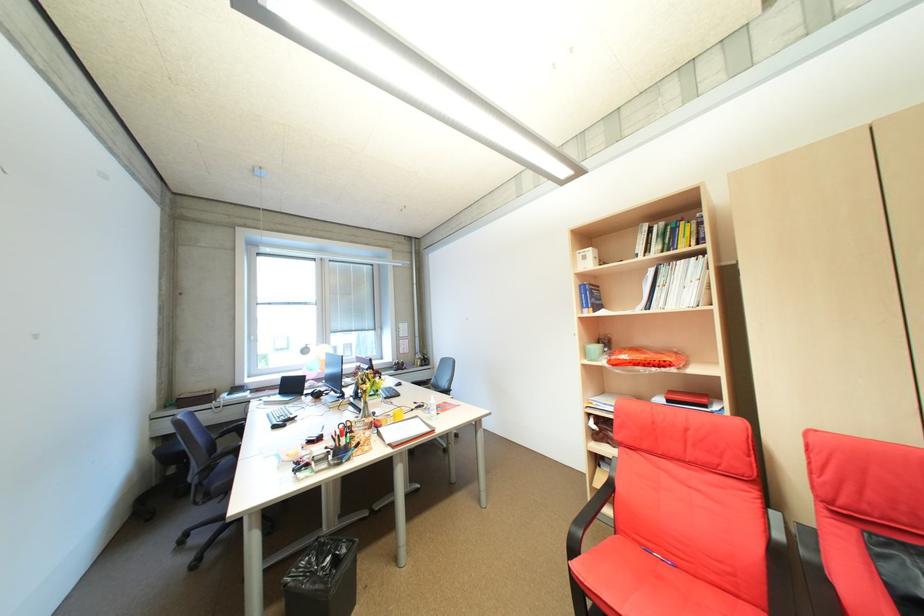
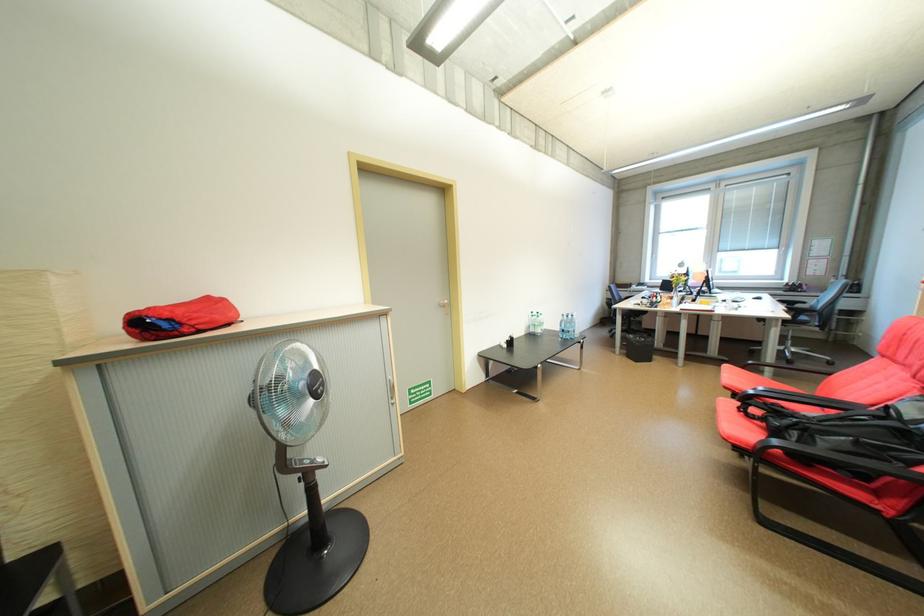
Question: I am providing you with two images of the same scene from different viewpoints. Which of the following objects are not visible in image2?

Choices:
 (A) chair sitting surface
 (B) black chair armrest
 (C) refrigerator main door
 (D) computer keyboard

Answer: (B)